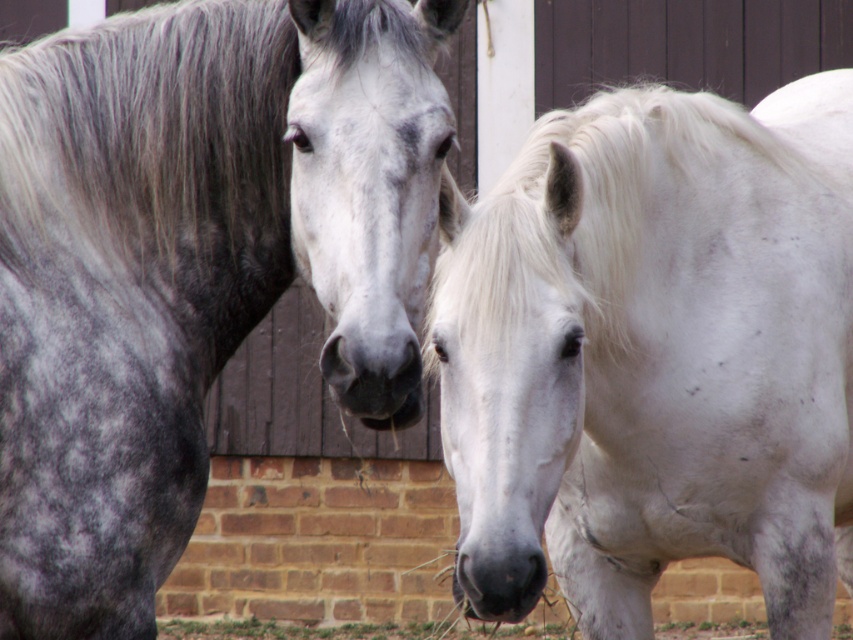
Find the location of a particular element. speckled gray coat at left is located at coordinates (184, 259).

Find the location of `speckled gray coat at left`. speckled gray coat at left is located at coordinates (184, 259).

Does speckled gray coat at left appear on the right side of gray matte nose at center?

In fact, speckled gray coat at left is to the left of gray matte nose at center.

In the scene shown: Is speckled gray coat at left closer to camera compared to gray matte nose at center?

Yes, it is in front of gray matte nose at center.

Describe the element at coordinates (184, 259) in the screenshot. I see `speckled gray coat at left` at that location.

The image size is (853, 640). What are the coordinates of `speckled gray coat at left` in the screenshot? It's located at (184, 259).

How much distance is there between speckled gray coat at left and white matte horse at center?

speckled gray coat at left and white matte horse at center are 14.53 inches apart.

Looking at this image, between speckled gray coat at left and white matte horse at center, which one has more height?

white matte horse at center is taller.

Is point (33, 426) positioned before point (793, 264)?

Yes, it is in front of point (793, 264).

Where is `speckled gray coat at left`? Image resolution: width=853 pixels, height=640 pixels. speckled gray coat at left is located at coordinates (184, 259).